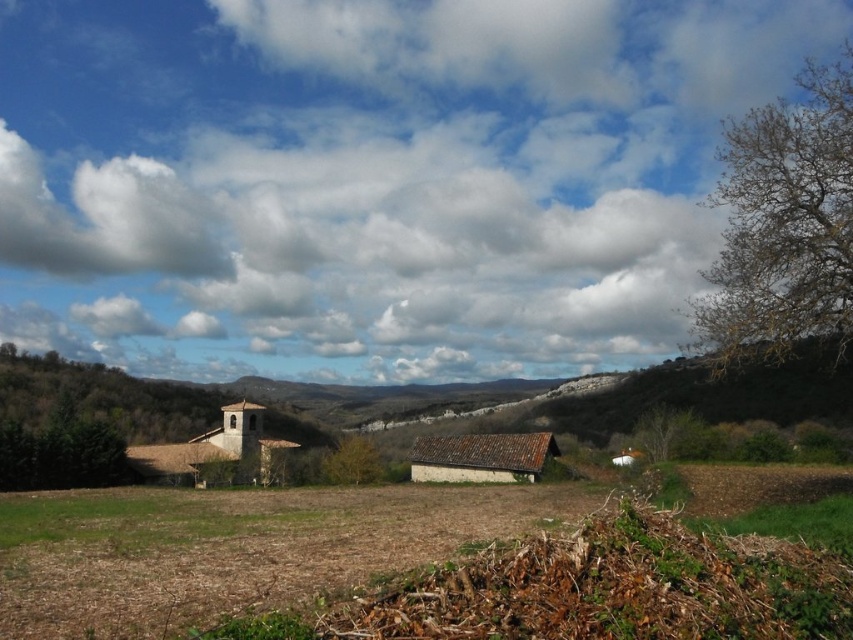
Is point (456, 438) farther from viewer compared to point (688, 416)?

No.

Is brown clay hut at center below brown rough tree at right?

Indeed, brown clay hut at center is positioned under brown rough tree at right.

Identify the location of brown clay hut at center. (480, 458).

Does brown soil at lower center appear on the left side of brown rough tree at right?

Yes, brown soil at lower center is to the left of brown rough tree at right.

Is brown soil at lower center below brown rough tree at right?

Actually, brown soil at lower center is above brown rough tree at right.

Identify the location of brown soil at lower center. The image size is (853, 640). (238, 547).

Does bare wood tree at right come behind brown clay hut at center?

No, it is not.

Is bare wood tree at right wider than brown clay hut at center?

No.

Who is more distant from viewer, (838, 339) or (532, 481)?

Positioned behind is point (532, 481).

The height and width of the screenshot is (640, 853). I want to click on bare wood tree at right, so click(784, 225).